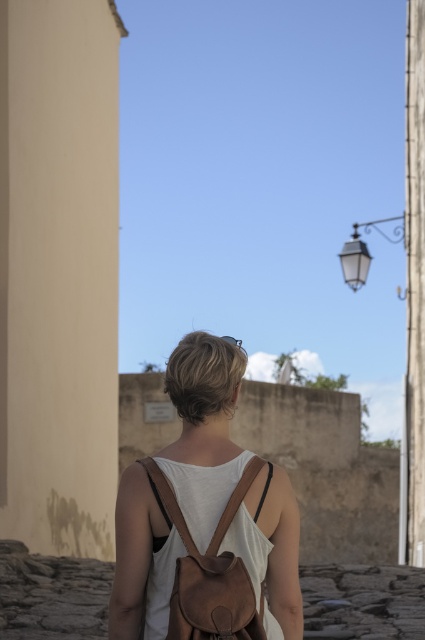
Which is above, brown leather backpack at center or leather backpack at back?

Positioned higher is brown leather backpack at center.

Where is `brown leather backpack at center`? brown leather backpack at center is located at coordinates (204, 429).

In order to click on brown leather backpack at center in this screenshot , I will do `click(204, 429)`.